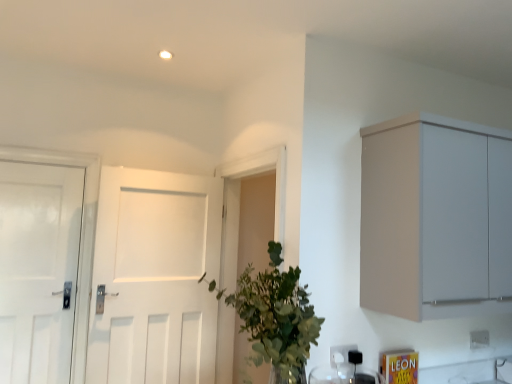
This screenshot has height=384, width=512. Find the location of `blank space above white matte door at left, which appears as the second door when viewed from the right (from a real-world perspective)`. blank space above white matte door at left, which appears as the second door when viewed from the right (from a real-world perspective) is located at coordinates click(x=46, y=161).